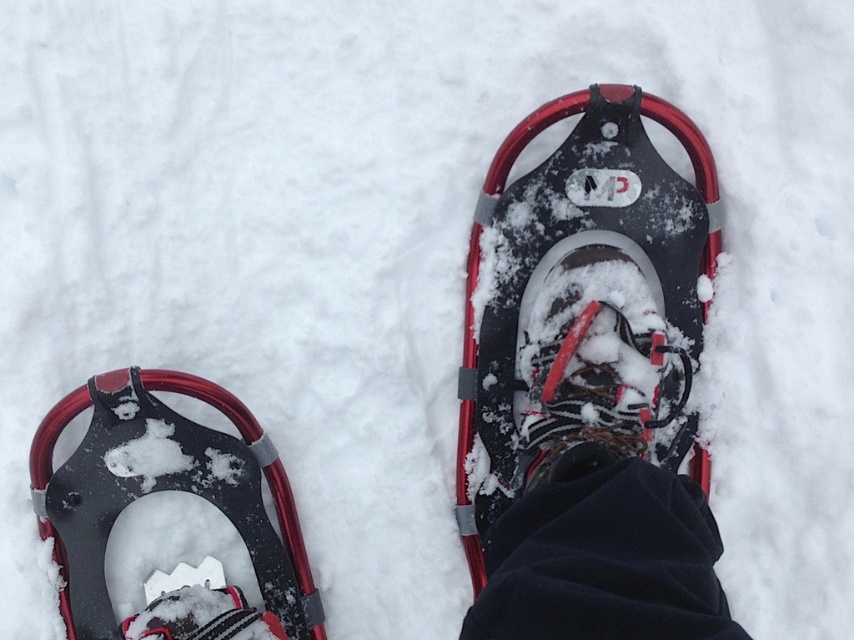
Is black rubber snowshoe at center positioned at the back of matte black snowshoe at lower left?

No.

Is black rubber snowshoe at center shorter than matte black snowshoe at lower left?

No, black rubber snowshoe at center is not shorter than matte black snowshoe at lower left.

Does point (664, 310) come closer to viewer compared to point (311, 625)?

No, (664, 310) is further to viewer.

Find the location of a particular element. black rubber snowshoe at center is located at coordinates (581, 264).